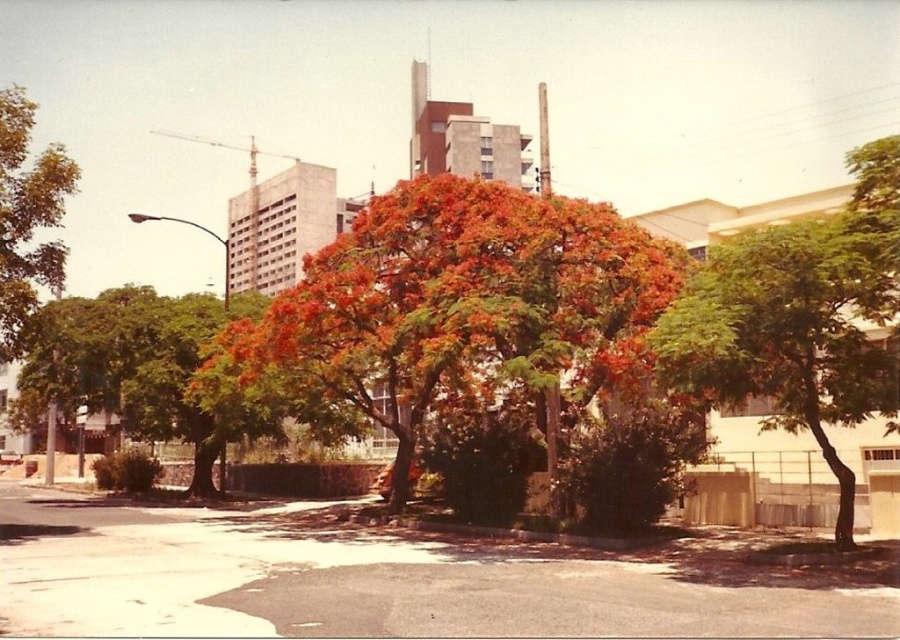
You are a city planner assessing the urban green space. You need to determine which tree, the green leafy tree at center or the green leafy tree at left, requires more sunlight. Based on their heights, which tree is likely taller and thus might block sunlight to the other?

The green leafy tree at left is taller than the green leafy tree at center, so it might block sunlight from reaching the shorter tree.

You are standing in an urban park and want to take a photo of the orange leafy tree at center. If you are currently 13.66 meters away from it, is this the closest you can get to the tree?

The orange leafy tree at center is exactly 13.66 meters away from the viewer, so this is the closest you can get to the tree.

You are standing in the urban park and see the green leafy tree at center and the green leafy tree at left. Which tree is positioned lower in the image?

The green leafy tree at center is located below the green leafy tree at left, so it is positioned lower in the image.